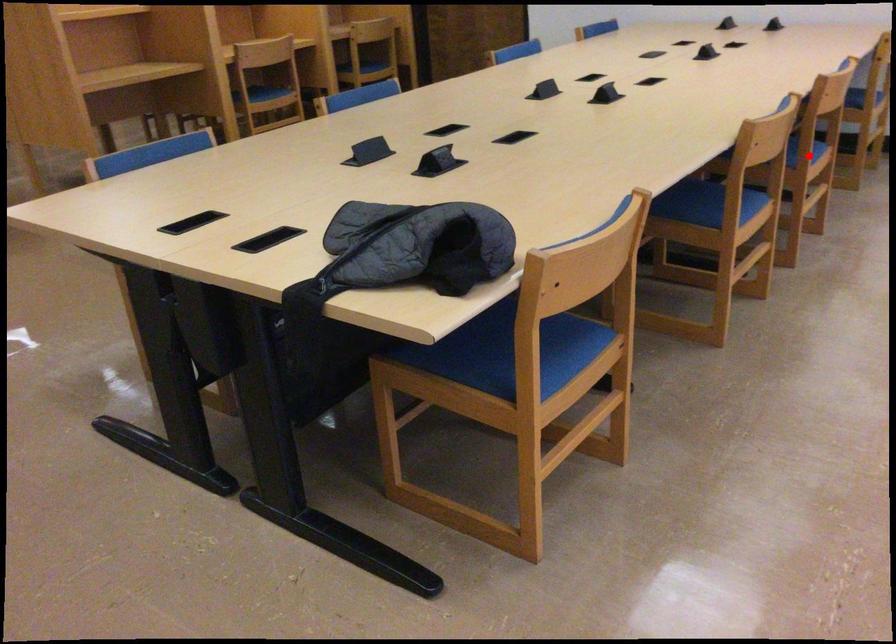
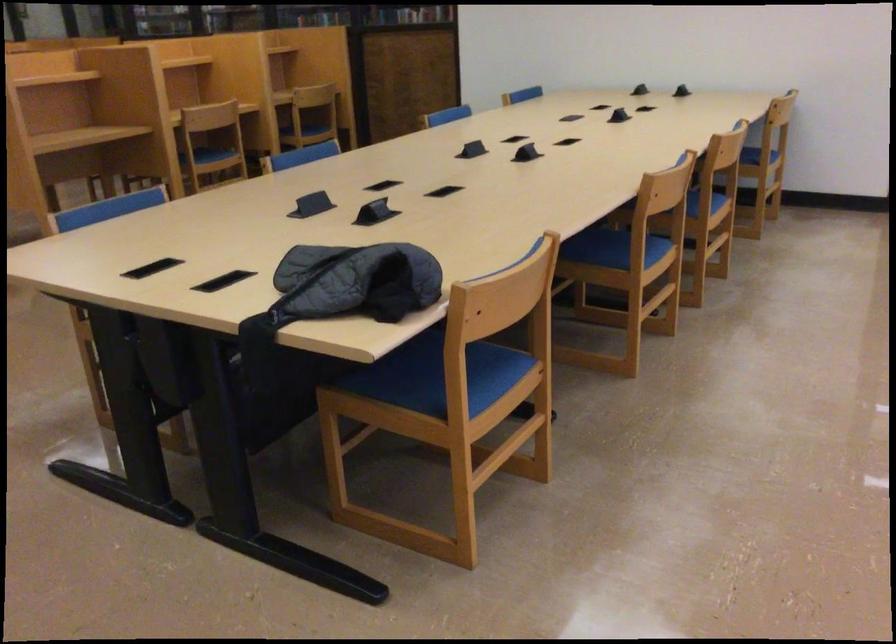
In the second image, find the point that corresponds to the highlighted location in the first image.

(702, 207)